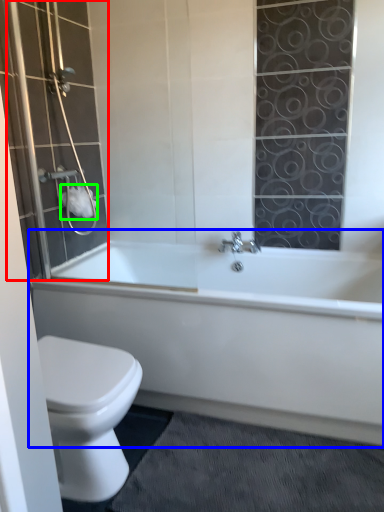
Question: Based on their relative distances, which object is farther from shower door (highlighted by a red box)? Choose from bathtub (highlighted by a blue box) and toilet paper (highlighted by a green box).

Choices:
 (A) bathtub
 (B) toilet paper

Answer: (A)